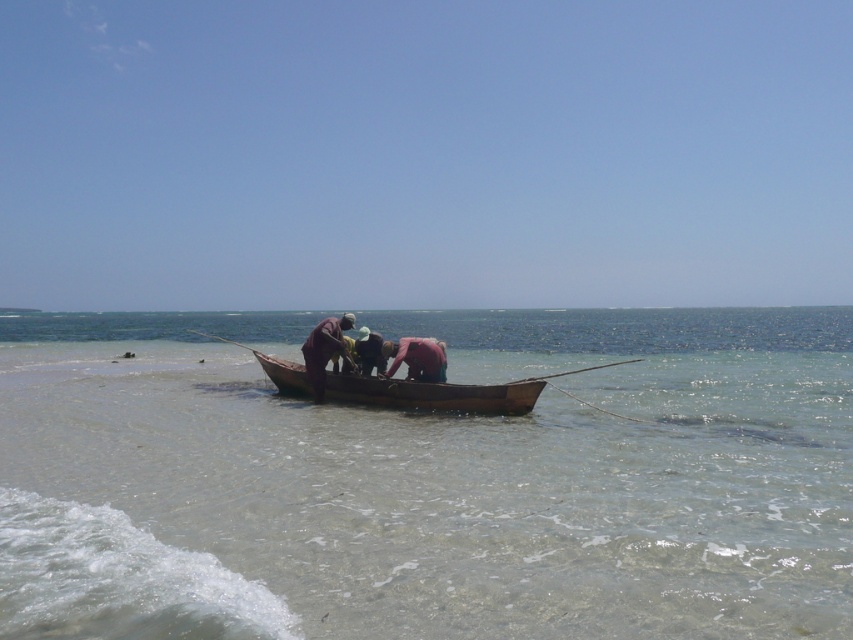
Question: Which object is farther from the camera taking this photo?

Choices:
 (A) clear water at boat center
 (B) brown wooden canoe at center
 (C) smooth pink fabric at center

Answer: (B)

Question: Among these objects, which one is farthest from the camera?

Choices:
 (A) dark brown wooden boat at center
 (B) clear water at boat center

Answer: (A)

Question: Is smooth pink fabric at center wider than brown fabric hat at center?

Choices:
 (A) no
 (B) yes

Answer: (B)

Question: Observing the image, what is the correct spatial positioning of brown wooden canoe at center in reference to dark brown wooden boat at center?

Choices:
 (A) left
 (B) right

Answer: (B)

Question: Is brown wooden canoe at center smaller than dark brown wooden boat at center?

Choices:
 (A) yes
 (B) no

Answer: (A)

Question: Which of the following is the farthest from the observer?

Choices:
 (A) (256, 349)
 (B) (399, 360)
 (C) (339, 317)

Answer: (A)